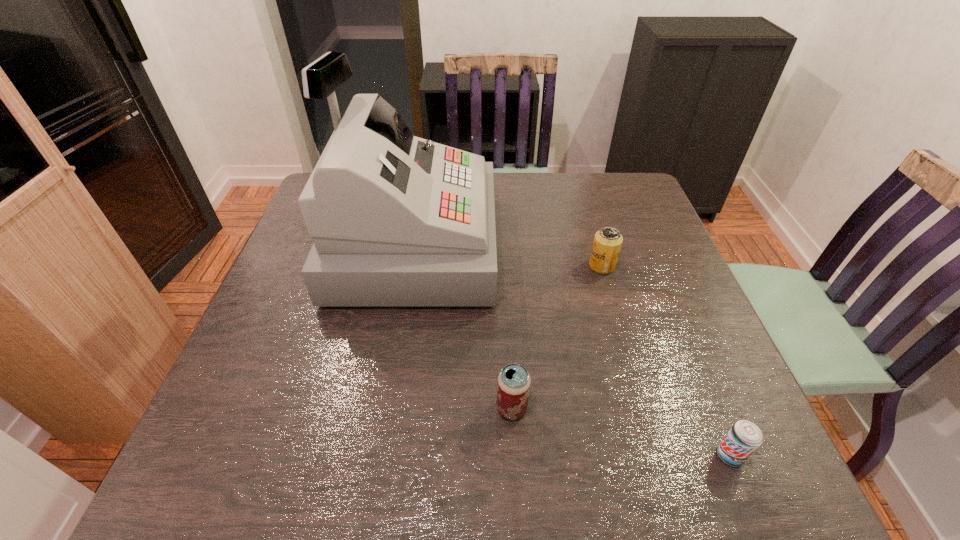
Locate an element on the screen. This screenshot has width=960, height=540. vacant space at the far right corner of the desktop is located at coordinates (635, 178).

Identify the location of empty space between the cash register and the rightmost object. The image size is (960, 540). (571, 350).

You are a GUI agent. You are given a task and a screenshot of the screen. Output one action in this format:
    pyautogui.click(x=<x>, y=<y>)
    Task: Click on the free spot between the farthest beer can and the second farthest beer can
    
    Given the screenshot: What is the action you would take?
    pyautogui.click(x=557, y=337)

This screenshot has height=540, width=960. I want to click on free space that is in between the second nearest object and the third object from left to right, so click(x=557, y=337).

Where is `empty space that is in between the cash register and the farthest beer can`? empty space that is in between the cash register and the farthest beer can is located at coordinates (507, 256).

Locate an element on the screen. The image size is (960, 540). free space between the leftmost beer can and the cash register is located at coordinates (462, 327).

The image size is (960, 540). I want to click on free space between the cash register and the nearest object, so click(571, 350).

Locate an element on the screen. The width and height of the screenshot is (960, 540). blank region between the third farthest object and the rightmost beer can is located at coordinates (621, 432).

This screenshot has height=540, width=960. In order to click on empty space that is in between the leftmost beer can and the second beer can from left to right in this screenshot , I will do `click(557, 337)`.

Locate an element on the screen. The width and height of the screenshot is (960, 540). free area in between the tallest object and the leftmost beer can is located at coordinates (462, 327).